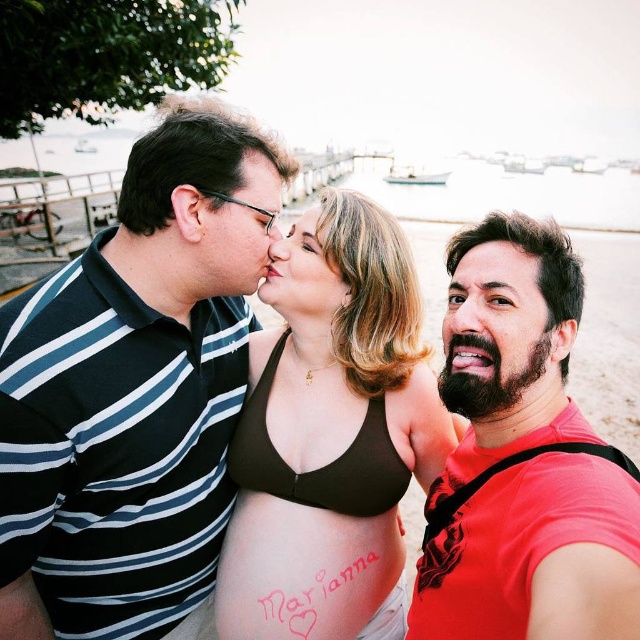
You are holding a 10 feet long fishing rod and want to cast it into the water without hitting anyone. The camera is at your eye level. Is the point at coordinate point (477, 289) within the safe distance of your fishing rod?

The distance between point (477, 289) and the camera is 9.94 feet, which is within the 10 feet length of the fishing rod. Therefore, casting the rod might hit the point, so it is not safe.

You are a photographer standing at the edge of the beach. You want to take a group photo of the bearded man at right and the matte brown hair at center. If your camera has a maximum focus range of 1.0 meters, will you be able to capture both subjects in focus?

The bearded man at right is 1.07 meters from matte brown hair at center. Since the distance between them exceeds the camera maximum focus range of 1.0 meters, the camera cannot focus on both subjects simultaneously. You need to adjust your position to reduce the distance between them or use a different camera setting.